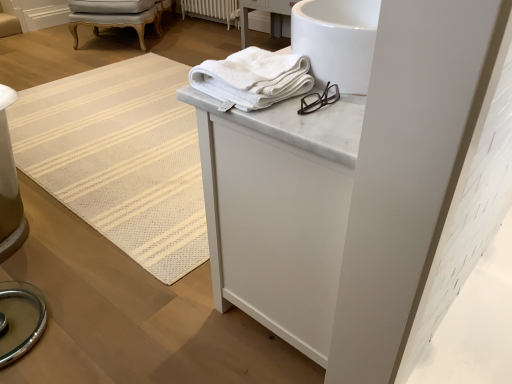
Find the location of a particular element. white marble cabinet at upper center is located at coordinates (366, 189).

Measure the distance between white textured mat at upper center and camera.

white textured mat at upper center is 5.45 feet from camera.

Identify the location of light gray upholstered chair at upper left. (118, 22).

What do you see at coordinates (118, 22) in the screenshot?
I see `light gray upholstered chair at upper left` at bounding box center [118, 22].

Identify the location of white cotton towel at upper center. The height and width of the screenshot is (384, 512). (253, 78).

The image size is (512, 384). In order to click on white marble cabinet at upper center in this screenshot , I will do `click(366, 189)`.

From a real-world perspective, is white cotton towel at upper center over white textured mat at upper center?

Correct, in the physical world, white cotton towel at upper center is higher than white textured mat at upper center.

Can white textured mat at upper center be found inside white cotton towel at upper center?

Definitely not — white textured mat at upper center is not inside white cotton towel at upper center.

Which object is more forward, white cotton towel at upper center or white marble cabinet at upper center?

white marble cabinet at upper center is closer to the camera.

Is point (264, 78) closer to viewer compared to point (338, 300)?

No.

Does white cotton towel at upper center touch white marble cabinet at upper center?

They are not placed beside each other.

From the image's perspective, which is below, white cotton towel at upper center or white marble cabinet at upper center?

From the image's view, white marble cabinet at upper center is below.

Is white painted radiator at center looking in the opposite direction of white cotton towel at upper center?

No, white painted radiator at center is not facing the opposite direction of white cotton towel at upper center.

Who is shorter, white painted radiator at center or white cotton towel at upper center?

white cotton towel at upper center.

Considering the sizes of white painted radiator at center and white cotton towel at upper center in the image, is white painted radiator at center wider or thinner than white cotton towel at upper center?

white painted radiator at center is thinner than white cotton towel at upper center.

Can you see white painted radiator at center touching white cotton towel at upper center?

No, white painted radiator at center is not making contact with white cotton towel at upper center.

Is point (245, 64) farther from camera compared to point (160, 23)?

No, (245, 64) is in front of (160, 23).

From the image's perspective, is white cotton towel at upper center beneath light gray upholstered chair at upper left?

Yes, from the image's perspective, white cotton towel at upper center is beneath light gray upholstered chair at upper left.

Is white cotton towel at upper center next to light gray upholstered chair at upper left?

white cotton towel at upper center and light gray upholstered chair at upper left are clearly separated.

Between white cotton towel at upper center and light gray upholstered chair at upper left, which one has larger width?

With larger width is light gray upholstered chair at upper left.

What's the angular difference between white marble cabinet at upper center and light gray upholstered chair at upper left's facing directions?

white marble cabinet at upper center and light gray upholstered chair at upper left are facing 122 degrees away from each other.

Between white marble cabinet at upper center and light gray upholstered chair at upper left, which one has smaller width?

Thinner between the two is white marble cabinet at upper center.

Could you tell me if white marble cabinet at upper center is turned towards light gray upholstered chair at upper left?

Yes, white marble cabinet at upper center faces towards light gray upholstered chair at upper left.

Which is farther, (145, 161) or (144, 32)?

The point (144, 32) is behind.

What's the angular difference between white textured mat at upper center and light gray upholstered chair at upper left's facing directions?

The angle between the facing direction of white textured mat at upper center and the facing direction of light gray upholstered chair at upper left is 124 degrees.

Which of these two, white textured mat at upper center or light gray upholstered chair at upper left, is bigger?

With larger size is light gray upholstered chair at upper left.

From a real-world perspective, is white textured mat at upper center physically located above or below light gray upholstered chair at upper left?

From a real-world perspective, white textured mat at upper center is physically below light gray upholstered chair at upper left.

Between white marble cabinet at upper center and white cotton towel at upper center, which one is positioned in front?

Positioned in front is white marble cabinet at upper center.

Does white marble cabinet at upper center have a smaller size compared to white cotton towel at upper center?

No, white marble cabinet at upper center is not smaller than white cotton towel at upper center.

Can you confirm if white marble cabinet at upper center is thinner than white cotton towel at upper center?

No, white marble cabinet at upper center is not thinner than white cotton towel at upper center.

In the image, there is a white cotton towel at upper center. In order to click on mat above it (from the image's perspective) in this screenshot , I will do `click(121, 158)`.

I want to click on bathroom cabinet in front of the white cotton towel at upper center, so click(x=366, y=189).

Looking at the image, which one is located further to light gray upholstered chair at upper left, white cotton towel at upper center or white painted radiator at center?

The object further to light gray upholstered chair at upper left is white cotton towel at upper center.

Which object lies further to the anchor point white cotton towel at upper center, white marble cabinet at upper center or white painted radiator at center?

white painted radiator at center is further to white cotton towel at upper center.

From the image, which object appears to be nearer to white cotton towel at upper center, white marble cabinet at upper center or white textured mat at upper center?

The object closer to white cotton towel at upper center is white marble cabinet at upper center.

Estimate the real-world distances between objects in this image. Which object is further from white marble cabinet at upper center, white textured mat at upper center or white cotton towel at upper center?

Among the two, white textured mat at upper center is located further to white marble cabinet at upper center.

Looking at the image, which one is located further to white textured mat at upper center, white painted radiator at center or light gray upholstered chair at upper left?

Among the two, white painted radiator at center is located further to white textured mat at upper center.

Which object lies further to the anchor point light gray upholstered chair at upper left, white textured mat at upper center or white painted radiator at center?

white textured mat at upper center is further to light gray upholstered chair at upper left.

Considering their positions, is white textured mat at upper center positioned further to light gray upholstered chair at upper left than white marble cabinet at upper center?

white marble cabinet at upper center is positioned further to the anchor light gray upholstered chair at upper left.

Which object lies nearer to the anchor point white marble cabinet at upper center, light gray upholstered chair at upper left or white textured mat at upper center?

white textured mat at upper center is positioned closer to the anchor white marble cabinet at upper center.

The height and width of the screenshot is (384, 512). I want to click on towel between white marble cabinet at upper center and light gray upholstered chair at upper left in the front-back direction, so click(x=253, y=78).

This screenshot has height=384, width=512. Identify the location of towel between white textured mat at upper center and white marble cabinet at upper center from left to right. (253, 78).

Where is `towel between white marble cabinet at upper center and white painted radiator at center along the z-axis`? towel between white marble cabinet at upper center and white painted radiator at center along the z-axis is located at coordinates (253, 78).

Locate an element on the screen. The width and height of the screenshot is (512, 384). mat positioned between white marble cabinet at upper center and light gray upholstered chair at upper left from near to far is located at coordinates (121, 158).